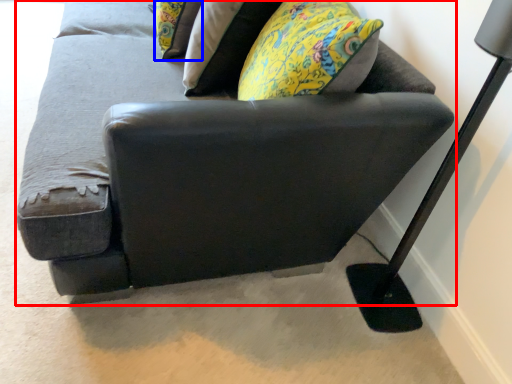
Question: Among these objects, which one is farthest to the camera, studio couch (highlighted by a red box) or pillow (highlighted by a blue box)?

Choices:
 (A) studio couch
 (B) pillow

Answer: (B)